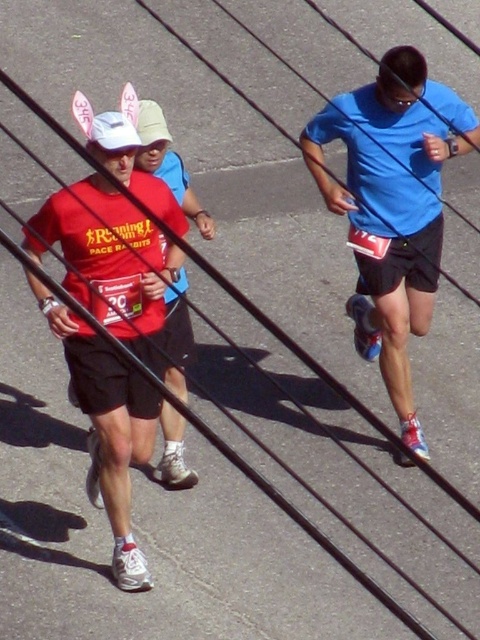
You are a photographer standing behind the runners. You need to capture a photo where both the blue matte shorts at center and the matte red shirt at left are clearly visible. Given their heights, which object should you focus on first to ensure both are in frame?

The blue matte shorts at center is much taller than the matte red shirt at left. To ensure both are in frame, focus on the blue matte shorts at center first as it is taller and will occupy more space in the photo.

You are a photographer positioned at the starting line of the marathon. You need to capture a photo where the blue matte shorts at center and the matte red shirt at left are both visible. Based on their positions, which object should appear higher in the photo?

The blue matte shorts at center should appear higher in the photo because the blue matte shorts at center is above matte red shirt at left.

You are a photographer at the marathon and need to capture both the blue matte shorts at center and the matte red shirt at left in a single shot. Based on their positions, which direction should you move your camera to include both subjects?

The blue matte shorts at center is positioned on the right side of the matte red shirt at left. To include both subjects in a single shot, you should move your camera to the left to capture the matte red shirt at left and then pan to the right to include the blue matte shorts at center.